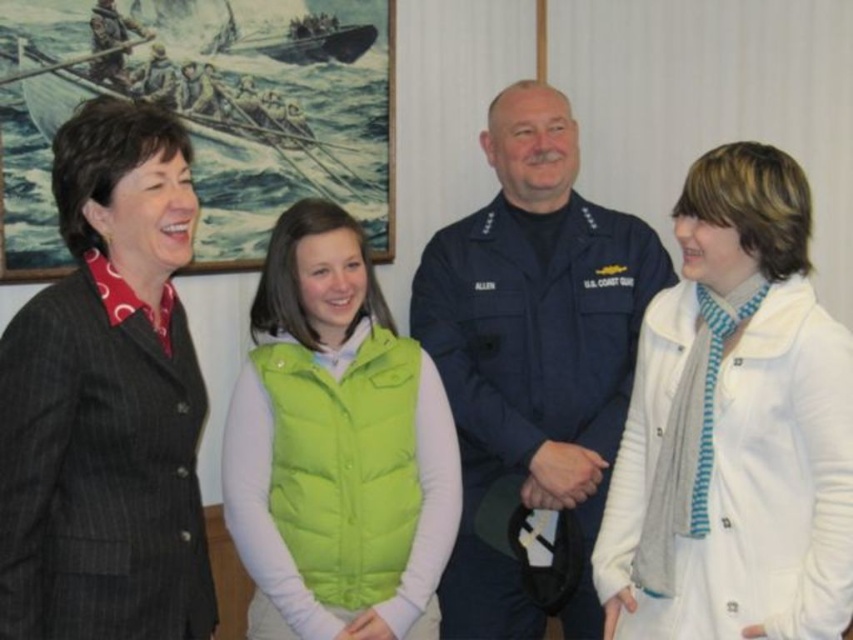
Question: Which object is positioned farthest from the white cotton coat at right?

Choices:
 (A) dark gray pinstripe suit at left
 (B) navy blue uniform at center

Answer: (A)

Question: Which of the following is the farthest from the observer?

Choices:
 (A) dark gray pinstripe suit at left
 (B) white cotton coat at right
 (C) green puffy vest at center

Answer: (C)

Question: Does white cotton coat at right appear on the right side of dark gray pinstripe suit at left?

Choices:
 (A) yes
 (B) no

Answer: (A)

Question: Does white cotton coat at right have a smaller size compared to dark gray pinstripe suit at left?

Choices:
 (A) yes
 (B) no

Answer: (B)

Question: Is navy blue uniform at center below green puffy vest at center?

Choices:
 (A) no
 (B) yes

Answer: (A)

Question: Which point is closer to the camera taking this photo?

Choices:
 (A) (115, 454)
 (B) (705, 428)

Answer: (A)